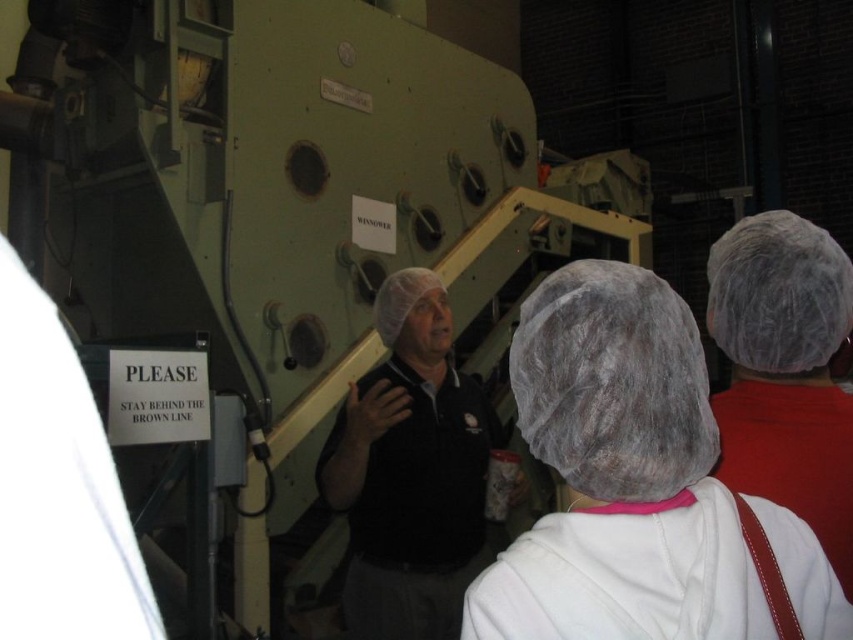
Which is above, white textured hairnet at center or black matte shirt at center?

white textured hairnet at center is higher up.

Is point (827, 573) closer to viewer compared to point (390, 518)?

Yes, it is in front of point (390, 518).

This screenshot has height=640, width=853. Identify the location of white textured hairnet at center. (618, 474).

Measure the distance from black matte shirt at center to white fuzzy hairnet at upper right.

They are 3.34 feet apart.

Does point (328, 461) lie behind point (804, 259)?

Yes, point (328, 461) is farther from viewer.

Between point (416, 420) and point (811, 252), which one is positioned behind?

The point (416, 420) is behind.

I want to click on black matte shirt at center, so click(410, 472).

Who is positioned more to the right, white textured hairnet at center or white fuzzy hairnet at upper right?

Positioned to the right is white fuzzy hairnet at upper right.

How much distance is there between white textured hairnet at center and white fuzzy hairnet at upper right?

white textured hairnet at center is 34.26 centimeters from white fuzzy hairnet at upper right.

The width and height of the screenshot is (853, 640). Identify the location of white textured hairnet at center. (618, 474).